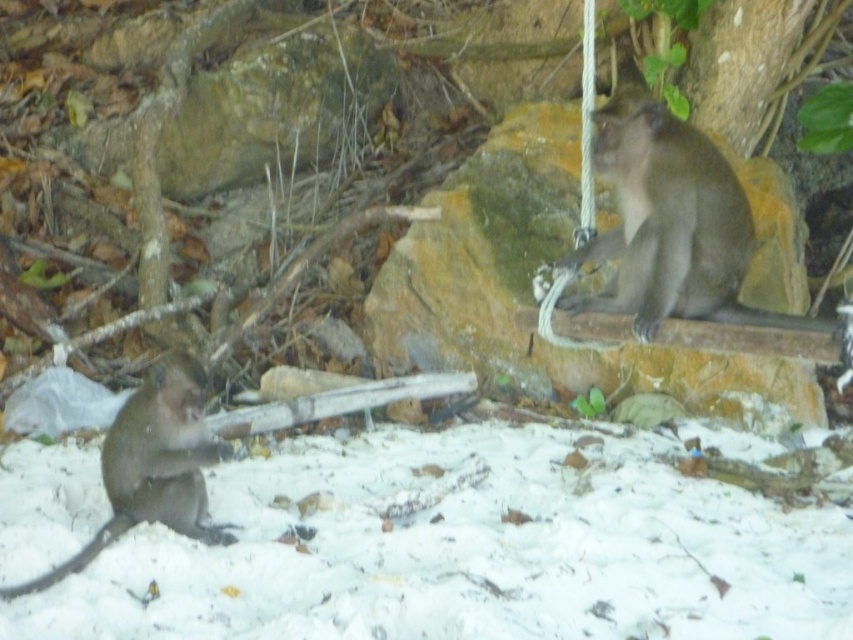
Question: From the image, what is the correct spatial relationship of smooth brown rock at upper right in relation to brown furry monkey at lower left?

Choices:
 (A) right
 (B) left

Answer: (A)

Question: Considering the relative positions of smooth brown rock at upper right and gray furry monkey at upper right in the image provided, where is smooth brown rock at upper right located with respect to gray furry monkey at upper right?

Choices:
 (A) below
 (B) above

Answer: (B)

Question: Among these objects, which one is farthest from the camera?

Choices:
 (A) white fluffy snow at lower left
 (B) brown furry monkey at lower left

Answer: (B)

Question: Based on their relative distances, which object is nearer to the smooth brown rock at upper right?

Choices:
 (A) gray furry monkey at upper right
 (B) brown furry monkey at lower left
 (C) white fluffy snow at lower left

Answer: (C)

Question: Which of the following is the farthest from the observer?

Choices:
 (A) (752, 262)
 (B) (645, 140)
 (C) (144, 406)
 (D) (32, 515)

Answer: (A)

Question: Does gray furry monkey at upper right have a lesser width compared to brown furry monkey at lower left?

Choices:
 (A) yes
 (B) no

Answer: (B)